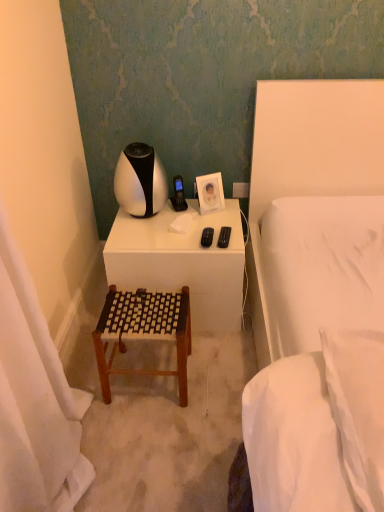
Locate an element on the screen. The width and height of the screenshot is (384, 512). vacant area that is situated to the right of brown woven stool at center is located at coordinates (216, 375).